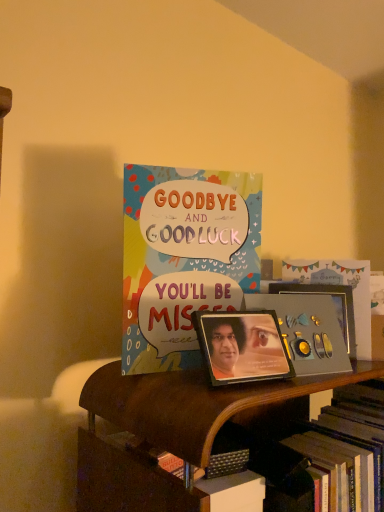
Question: Is metallic photo frame at center, the first picture frame positioned from the front, bigger than metallic gold picture frame at center, which ranks as the 1th picture frame in right-to-left order?

Choices:
 (A) yes
 (B) no

Answer: (A)

Question: Is metallic photo frame at center, arranged as the 2th picture frame when viewed from the back, aimed at metallic gold picture frame at center, the second picture frame from the left?

Choices:
 (A) yes
 (B) no

Answer: (B)

Question: Is metallic photo frame at center, the first picture frame positioned from the left, positioned in front of metallic gold picture frame at center, which ranks as the 1th picture frame in right-to-left order?

Choices:
 (A) no
 (B) yes

Answer: (B)

Question: Does metallic photo frame at center, the first picture frame positioned from the front, have a lesser height compared to metallic gold picture frame at center, the second picture frame from the left?

Choices:
 (A) no
 (B) yes

Answer: (A)

Question: From a real-world perspective, is metallic photo frame at center, the first picture frame positioned from the front, on top of metallic gold picture frame at center, the 2th picture frame viewed from the front?

Choices:
 (A) no
 (B) yes

Answer: (A)

Question: Is metallic photo frame at center, the 2th picture frame in the right-to-left sequence, turned away from metallic gold picture frame at center, the 1th picture frame when ordered from back to front?

Choices:
 (A) no
 (B) yes

Answer: (A)

Question: From a real-world perspective, is wooden bookshelf at lower center over multicolored paper card at center?

Choices:
 (A) yes
 (B) no

Answer: (B)

Question: Considering the relative positions of wooden bookshelf at lower center and multicolored paper card at center in the image provided, is wooden bookshelf at lower center in front of multicolored paper card at center?

Choices:
 (A) no
 (B) yes

Answer: (B)

Question: From the image's perspective, would you say wooden bookshelf at lower center is positioned over multicolored paper card at center?

Choices:
 (A) no
 (B) yes

Answer: (A)

Question: Is wooden bookshelf at lower center to the left of multicolored paper card at center from the viewer's perspective?

Choices:
 (A) yes
 (B) no

Answer: (B)

Question: Can you confirm if wooden bookshelf at lower center is smaller than multicolored paper card at center?

Choices:
 (A) yes
 (B) no

Answer: (B)

Question: Does wooden bookshelf at lower center have a lesser width compared to multicolored paper card at center?

Choices:
 (A) yes
 (B) no

Answer: (B)

Question: Is metallic gold picture frame at center, the second picture frame from the left, completely or partially outside of multicolored paper card at center?

Choices:
 (A) yes
 (B) no

Answer: (A)